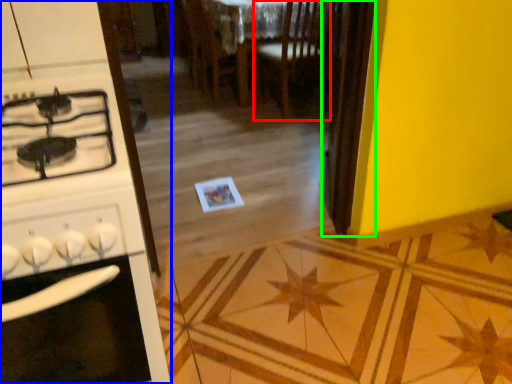
Question: Which object is the farthest from chair (highlighted by a red box)? Choose among these: kitchen appliance (highlighted by a blue box) or screen door (highlighted by a green box).

Choices:
 (A) kitchen appliance
 (B) screen door

Answer: (A)